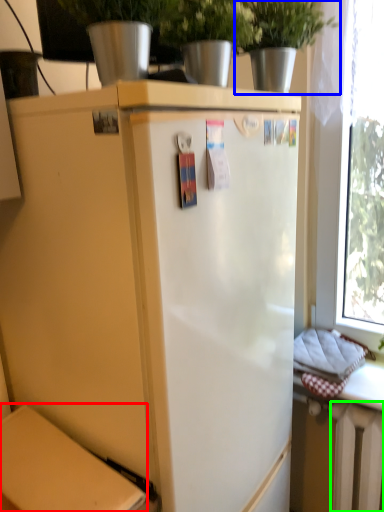
Question: Estimate the real-world distances between objects in this image. Which object is closer to back (highlighted by a red box), houseplant (highlighted by a blue box) or radiator (highlighted by a green box)?

Choices:
 (A) houseplant
 (B) radiator

Answer: (B)